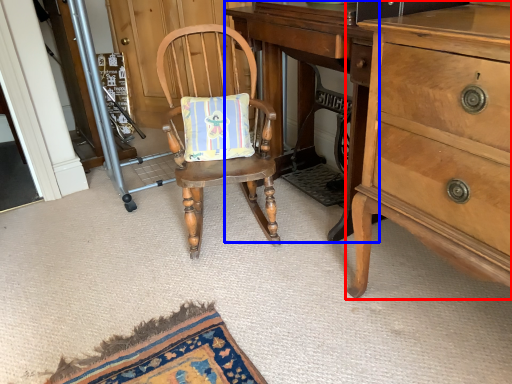
Question: Among these objects, which one is farthest to the camera, cabinetry (highlighted by a red box) or changing table (highlighted by a blue box)?

Choices:
 (A) cabinetry
 (B) changing table

Answer: (B)